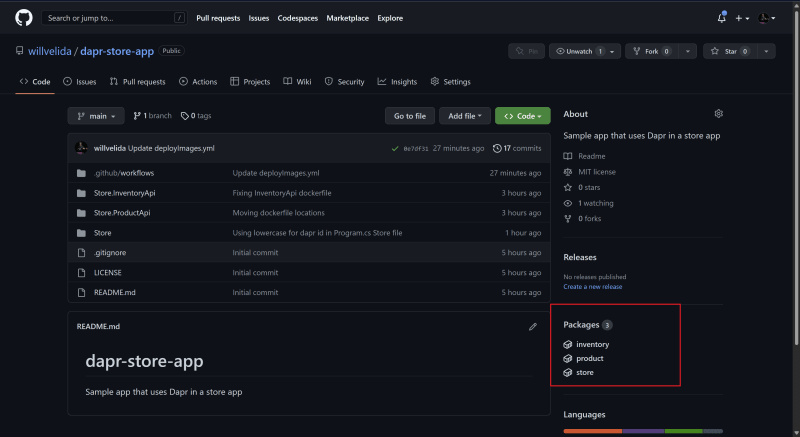
Locate an element on the screen. Image resolution: width=800 pixels, height=437 pixels. files and folders is located at coordinates (113, 178), (110, 196), (110, 207), (109, 224), (117, 250), (117, 273), (117, 289).